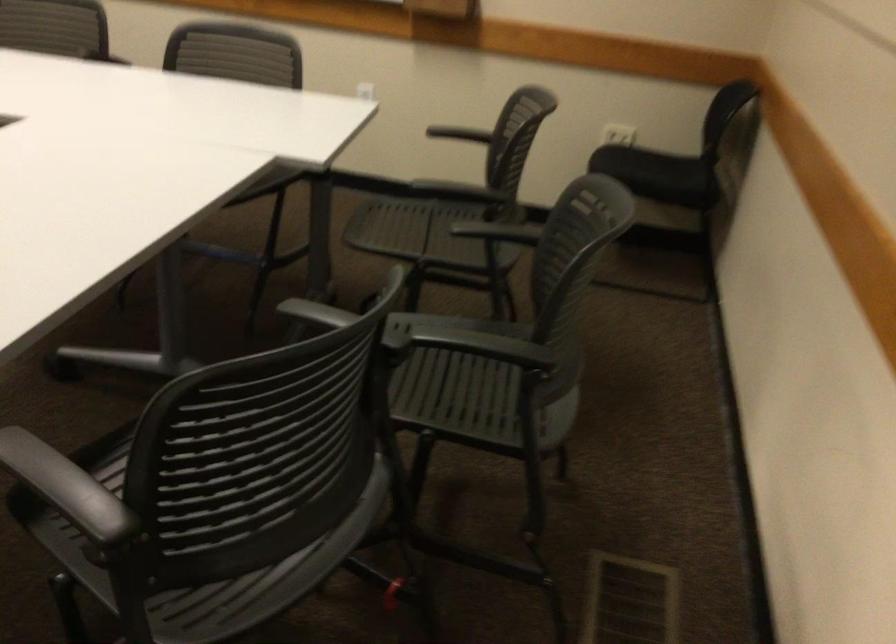
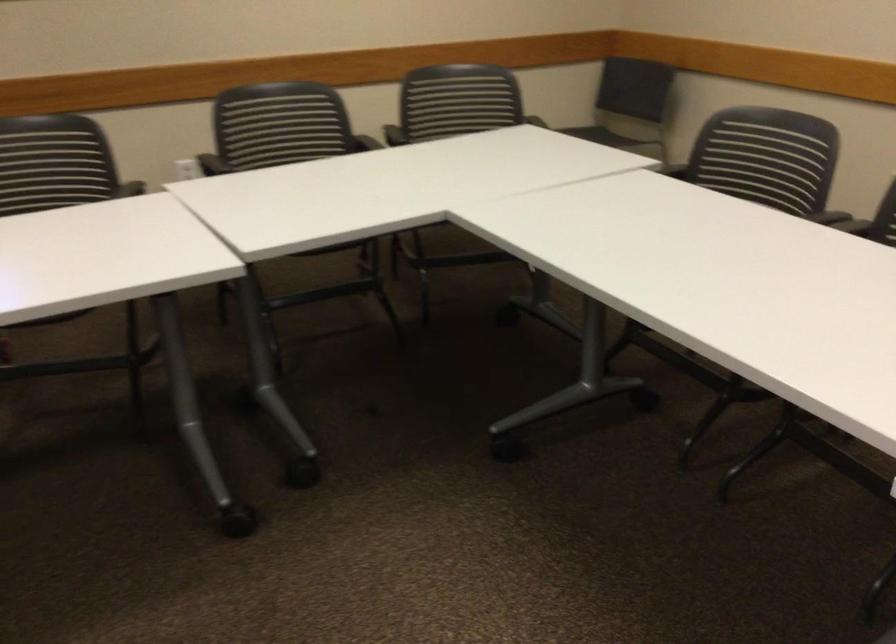
Find the pixel in the second image that matches point 339,431 in the first image.

(52, 163)